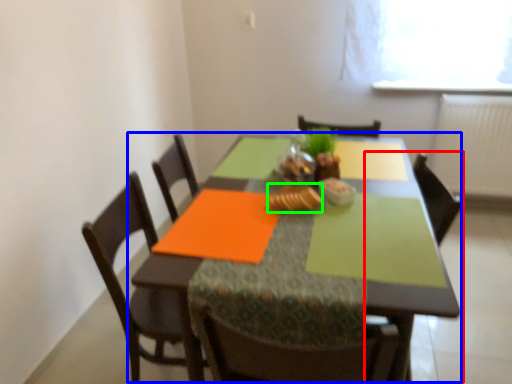
Question: Which is nearer to the armchair (highlighted by a red box)? kitchen & dining room table (highlighted by a blue box) or food (highlighted by a green box).

Choices:
 (A) kitchen & dining room table
 (B) food

Answer: (B)